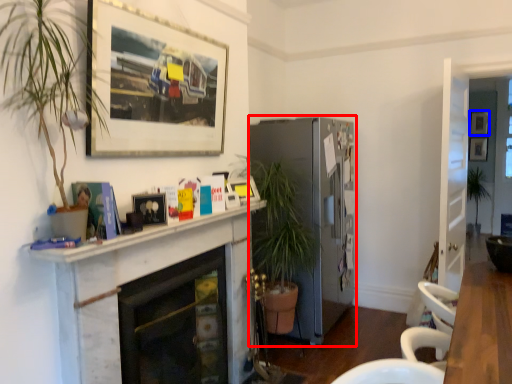
Question: Which point is closer to the camera, fireplace (highlighted by a red box) or picture frame (highlighted by a blue box)?

Choices:
 (A) fireplace
 (B) picture frame

Answer: (A)